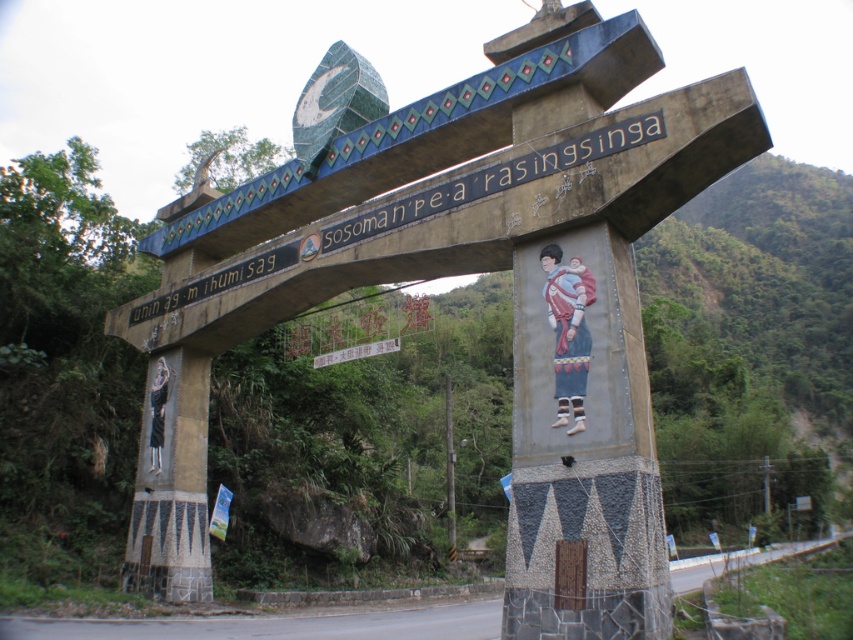
Question: Can you confirm if carved stone sign at center is wider than metallic pole at center?

Choices:
 (A) yes
 (B) no

Answer: (A)

Question: Does carved stone sign at center lie behind metallic pole at center?

Choices:
 (A) no
 (B) yes

Answer: (A)

Question: From the image, what is the correct spatial relationship of carved stone sign at center in relation to metallic pole at center?

Choices:
 (A) above
 (B) below

Answer: (A)

Question: Which of the following is the farthest from the observer?

Choices:
 (A) 445,182
 (B) 445,422

Answer: (B)